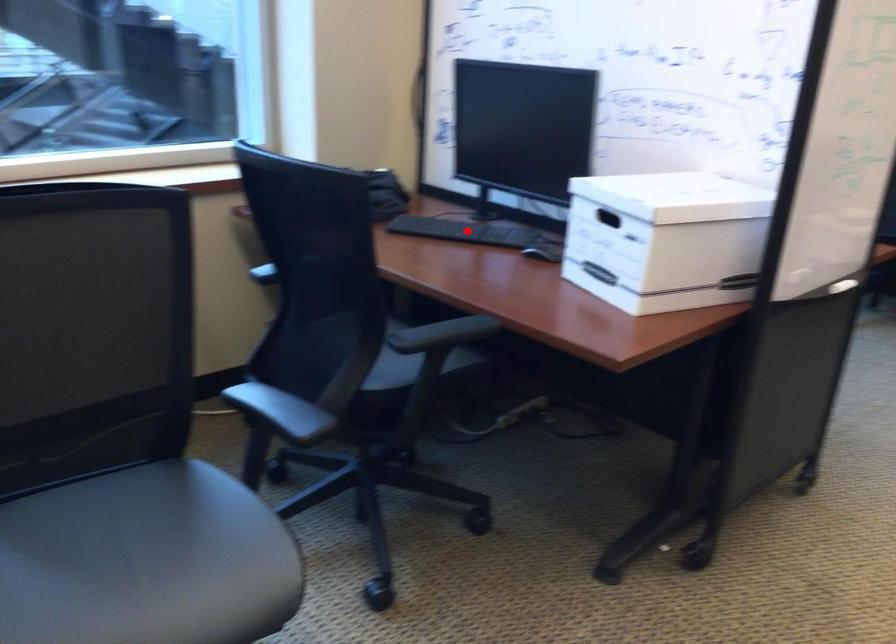
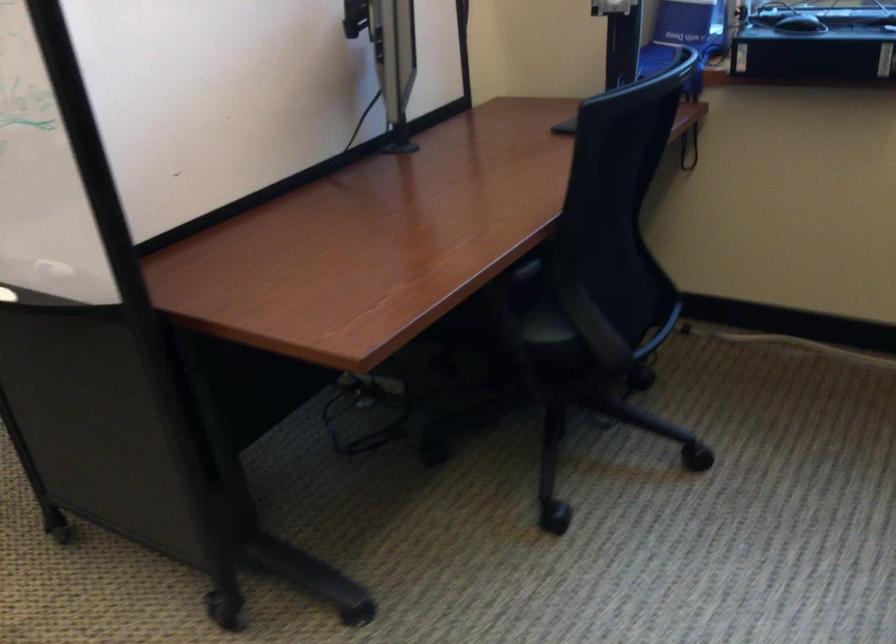
Question: I am providing you with two images of the same scene from different viewpoints. A red point is marked on the first image. Can you still see the location of the red point in image 2?

Choices:
 (A) Yes
 (B) No

Answer: (B)